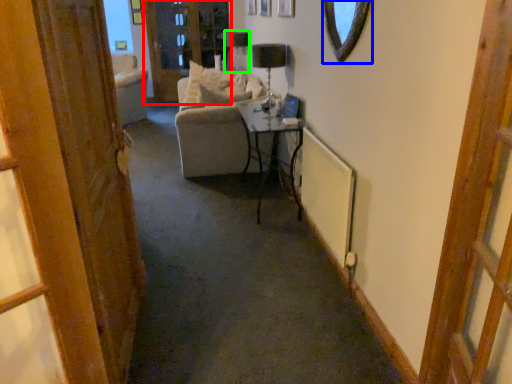
Question: Which is farther away from screen door (highlighted by a red box)? mirror (highlighted by a blue box) or lamp (highlighted by a green box)?

Choices:
 (A) mirror
 (B) lamp

Answer: (A)